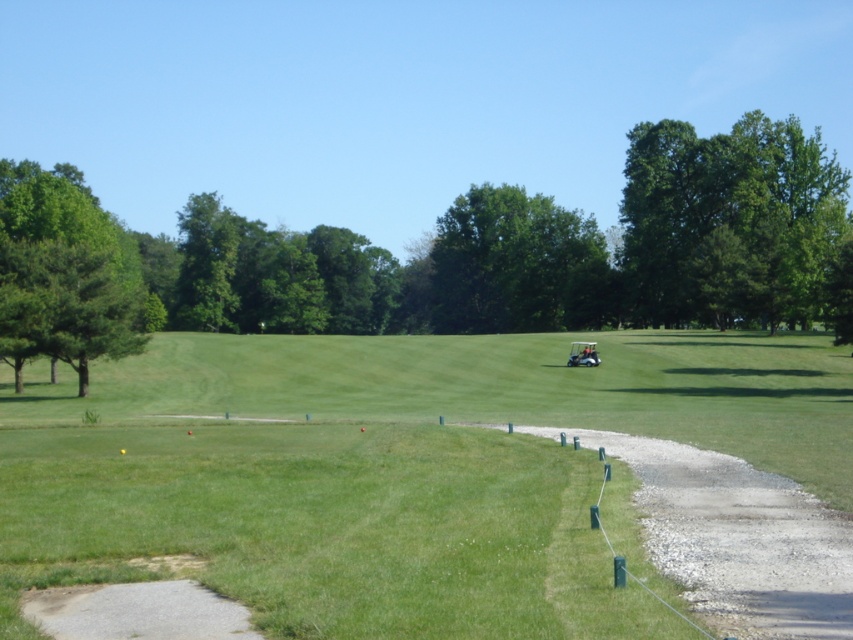
Question: Is green leafy tree at left positioned before green leafy tree at center?

Choices:
 (A) yes
 (B) no

Answer: (A)

Question: Can you confirm if green grassy golf course at center is wider than green leafy tree at upper right?

Choices:
 (A) yes
 (B) no

Answer: (B)

Question: Can you confirm if green grassy golf course at center is thinner than green leafy tree at center?

Choices:
 (A) no
 (B) yes

Answer: (A)

Question: Among these objects, which one is nearest to the camera?

Choices:
 (A) green grassy golf course at center
 (B) green leafy tree at center
 (C) green leafy tree at upper right

Answer: (A)

Question: Which object appears closest to the camera in this image?

Choices:
 (A) green leafy tree at upper right
 (B) green leafy tree at center
 (C) green leafy tree at left
 (D) green grassy golf course at center

Answer: (D)

Question: Which object is closer to the camera taking this photo?

Choices:
 (A) green leafy tree at left
 (B) green grassy golf course at center
 (C) green leafy tree at center
 (D) green leafy tree at upper right

Answer: (B)